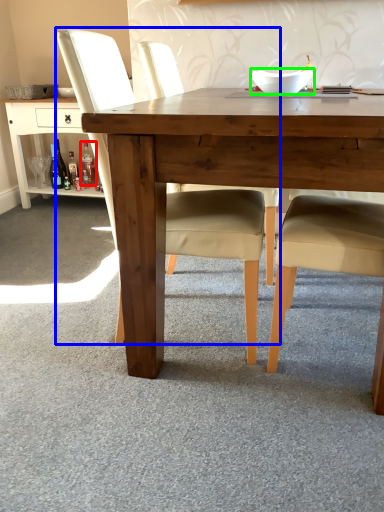
Question: Which object is positioned closest to bottle (highlighted by a red box)? Select from chair (highlighted by a blue box) and bowl (highlighted by a green box).

Choices:
 (A) chair
 (B) bowl

Answer: (B)